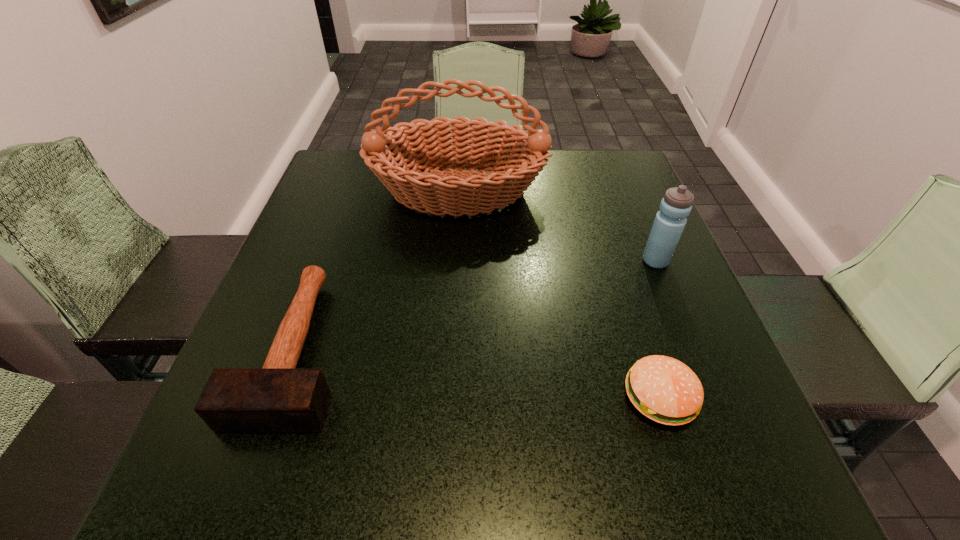
Where is `vacant space at the far left corner of the desktop`? vacant space at the far left corner of the desktop is located at coordinates (350, 172).

Image resolution: width=960 pixels, height=540 pixels. I want to click on free space at the near left corner of the desktop, so click(x=271, y=469).

In the image, there is a desktop. What are the coordinates of `blank space at the far right corner` in the screenshot? It's located at (588, 186).

At what (x,y) coordinates should I click in order to perform the action: click on free space at the near right corner of the desktop. Please return your answer as a coordinate pair (x, y). The image size is (960, 540). Looking at the image, I should click on (753, 465).

The height and width of the screenshot is (540, 960). What are the coordinates of `free area in between the mallet and the third shortest object` in the screenshot? It's located at (476, 304).

You are a GUI agent. You are given a task and a screenshot of the screen. Output one action in this format:
    pyautogui.click(x=<x>, y=<y>)
    Task: Click on the free space between the tallest object and the patty
    This screenshot has height=540, width=960.
    Given the screenshot: What is the action you would take?
    pyautogui.click(x=559, y=294)

At what (x,y) coordinates should I click in order to perform the action: click on unoccupied area between the tallest object and the second tallest object. Please return your answer as a coordinate pair (x, y). Looking at the image, I should click on (557, 226).

Locate an element on the screen. This screenshot has width=960, height=540. vacant area that lies between the shortest object and the farthest object is located at coordinates (559, 294).

Locate an element on the screen. vacant area that lies between the tallest object and the mallet is located at coordinates (377, 269).

This screenshot has height=540, width=960. What are the coordinates of `vacant space that's between the farthest object and the shortest object` in the screenshot? It's located at (559, 294).